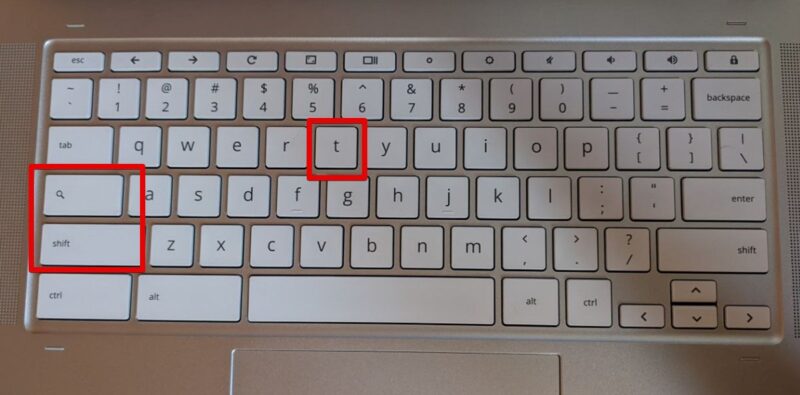
You are a GUI agent. You are given a task and a screenshot of the screen. Output one action in this format:
    pyautogui.click(x=<x>, y=<y>)
    Task: Click on the keys on keyboard with space in red boxes
    The width and height of the screenshot is (800, 395).
    Given the screenshot: What is the action you would take?
    pyautogui.click(x=114, y=240), pyautogui.click(x=98, y=199), pyautogui.click(x=142, y=195), pyautogui.click(x=342, y=147)